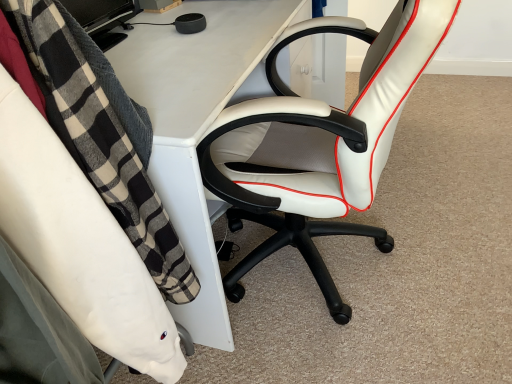
Question: From a real-world perspective, does white leather office chair at center, which is the second chair in left-to-right order, stand above white plastic desk at center?

Choices:
 (A) yes
 (B) no

Answer: (A)

Question: Does white leather office chair at center, which is the second chair in left-to-right order, appear on the right side of white plastic desk at center?

Choices:
 (A) no
 (B) yes

Answer: (B)

Question: Is white leather office chair at center, which is the 1th chair in right-to-left order, smaller than white plastic desk at center?

Choices:
 (A) no
 (B) yes

Answer: (B)

Question: Is white leather office chair at center, which is the second chair in left-to-right order, far away from white plastic desk at center?

Choices:
 (A) yes
 (B) no

Answer: (B)

Question: From a real-world perspective, is white leather office chair at center, which is the second chair in left-to-right order, located beneath white plastic desk at center?

Choices:
 (A) yes
 (B) no

Answer: (B)

Question: Can you confirm if white leather office chair at center, which is the 1th chair in right-to-left order, is taller than white plastic desk at center?

Choices:
 (A) yes
 (B) no

Answer: (A)

Question: Is white leather office chair at right, placed as the second chair when sorted from right to left, surrounded by white leather office chair at center, which is the second chair in left-to-right order?

Choices:
 (A) no
 (B) yes

Answer: (A)

Question: Could you tell me if white leather office chair at center, which is the 1th chair in right-to-left order, is facing white leather office chair at right, placed as the second chair when sorted from right to left?

Choices:
 (A) no
 (B) yes

Answer: (A)

Question: Is white leather office chair at center, which is the second chair in left-to-right order, behind white leather office chair at right, the first chair positioned from the left?

Choices:
 (A) no
 (B) yes

Answer: (B)

Question: From a real-world perspective, does white leather office chair at center, which is the second chair in left-to-right order, sit lower than white leather office chair at right, the first chair positioned from the left?

Choices:
 (A) yes
 (B) no

Answer: (A)

Question: Can you confirm if white leather office chair at center, which is the 1th chair in right-to-left order, is positioned to the right of white leather office chair at right, the first chair positioned from the left?

Choices:
 (A) yes
 (B) no

Answer: (A)

Question: Is white leather office chair at center, which is the 1th chair in right-to-left order, taller than white leather office chair at right, placed as the second chair when sorted from right to left?

Choices:
 (A) no
 (B) yes

Answer: (B)

Question: Is white plastic desk at center shorter than white leather office chair at center, which is the second chair in left-to-right order?

Choices:
 (A) yes
 (B) no

Answer: (A)